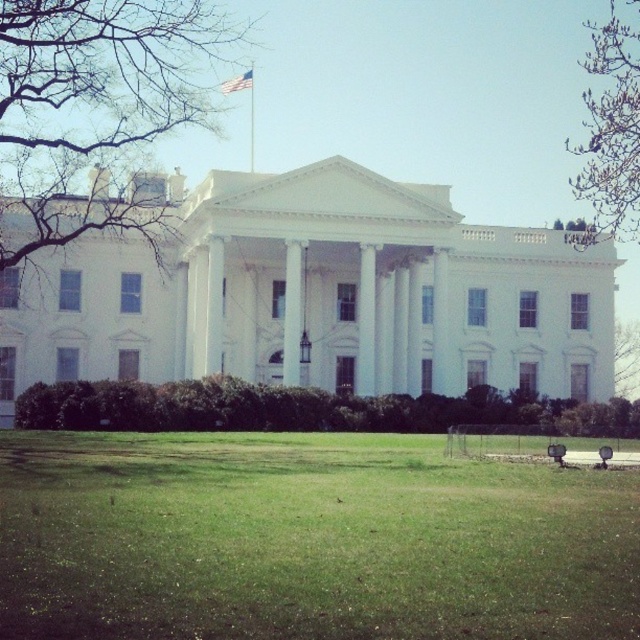
Can you confirm if metallic flag pole at upper center is smaller than white fabric flag at upper center?

Yes, metallic flag pole at upper center is smaller than white fabric flag at upper center.

How far apart are metallic flag pole at upper center and white fabric flag at upper center?

metallic flag pole at upper center is 8.95 feet from white fabric flag at upper center.

Who is more forward, (248, 81) or (244, 74)?

Point (248, 81)

This screenshot has width=640, height=640. In order to click on metallic flag pole at upper center in this screenshot , I will do `click(252, 115)`.

Does point (340, 632) lie in front of point (228, 83)?

That is True.

Image resolution: width=640 pixels, height=640 pixels. I want to click on green grass at center, so click(x=307, y=540).

Between point (172, 579) and point (250, 67), which one is positioned in front?

Positioned in front is point (172, 579).

You are a GUI agent. You are given a task and a screenshot of the screen. Output one action in this format:
    pyautogui.click(x=<x>, y=<y>)
    Task: Click on the green grass at center
    This screenshot has height=640, width=640.
    Given the screenshot: What is the action you would take?
    pyautogui.click(x=307, y=540)

Does green grass at center have a smaller size compared to metallic flag pole at upper center?

Incorrect, green grass at center is not smaller in size than metallic flag pole at upper center.

Find the location of a particular element. The image size is (640, 640). green grass at center is located at coordinates click(307, 540).